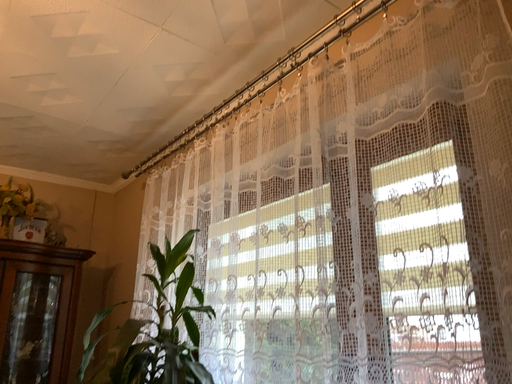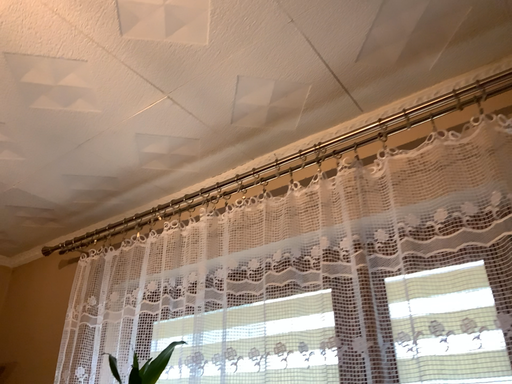
Question: How did the camera likely rotate when shooting the video?

Choices:
 (A) rotated upward
 (B) rotated downward

Answer: (A)